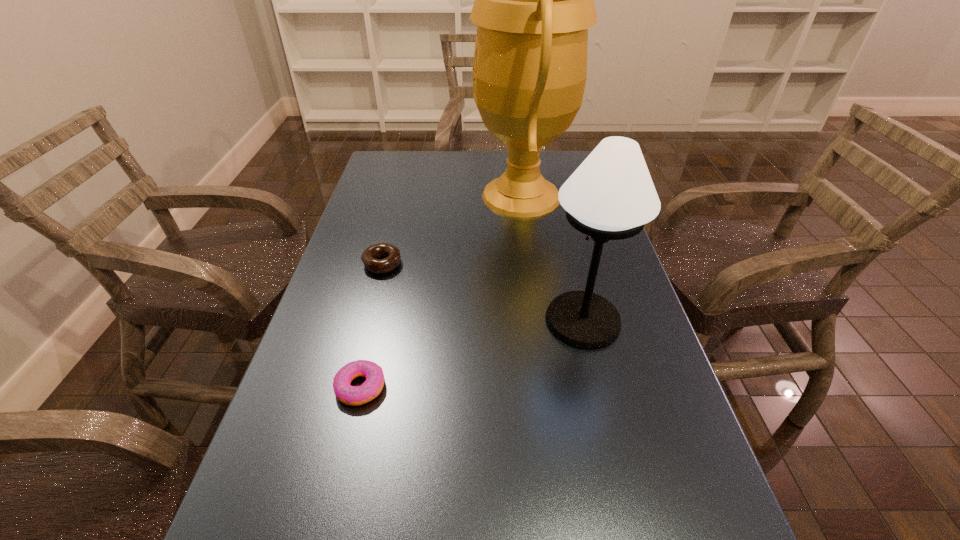
What are the coordinates of `the tallest object` in the screenshot? It's located at (534, 0).

Where is `the second tallest object`? This screenshot has height=540, width=960. the second tallest object is located at coordinates (611, 196).

Find the location of a particular element. The width and height of the screenshot is (960, 540). the third farthest object is located at coordinates (611, 196).

Where is `the farther doughnut`? the farther doughnut is located at coordinates (369, 257).

At what (x,y) coordinates should I click in order to perform the action: click on the nearest object. Please return your answer as a coordinate pair (x, y). This screenshot has width=960, height=540. Looking at the image, I should click on (350, 395).

In order to click on vacant space located on the engravings side of the tallest object in this screenshot , I will do `click(385, 196)`.

Identify the location of free space located 0.230m on the engravings side of the tallest object. This screenshot has height=540, width=960. (397, 196).

At what (x,y) coordinates should I click in order to perform the action: click on vacant space located on the engravings side of the tallest object. Please return your answer as a coordinate pair (x, y). The image size is (960, 540). Looking at the image, I should click on (375, 196).

The height and width of the screenshot is (540, 960). In order to click on free point located 0.070m on the left of the table lamp in this screenshot , I will do `click(512, 320)`.

Locate an element on the screen. This screenshot has width=960, height=540. vacant space located 0.400m on the front of the farther doughnut is located at coordinates (340, 424).